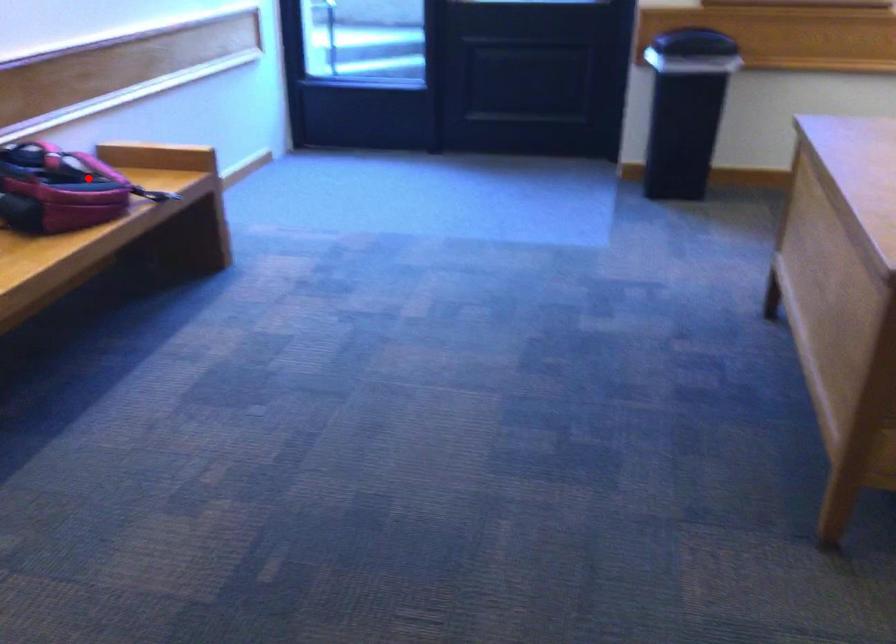
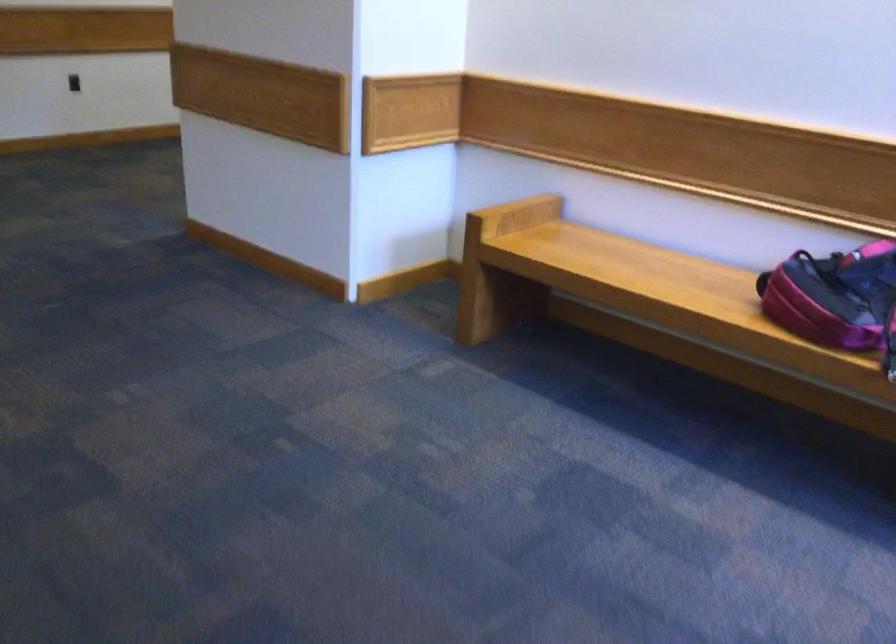
Question: A red point is marked in image1. In image2, is the corresponding 3D point closer to the camera or farther? Reply with the corresponding letter.

Choices:
 (A) The corresponding 3D point is closer.
 (B) The corresponding 3D point is farther.

Answer: (A)